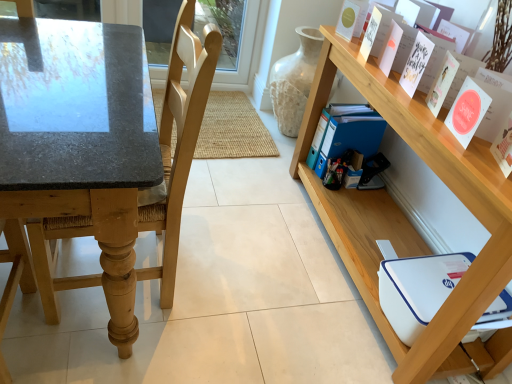
Where is `blank space to the left of translucent glass vase at upper right`? The image size is (512, 384). blank space to the left of translucent glass vase at upper right is located at coordinates (238, 120).